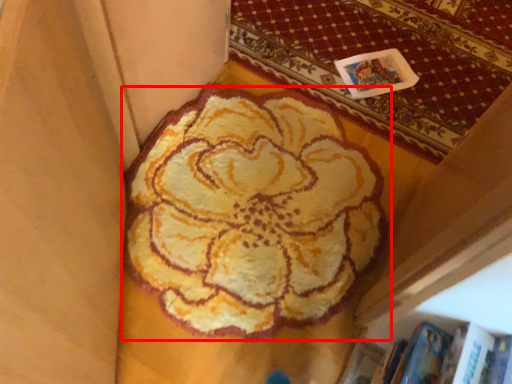
Question: Considering the relative positions of flower (annotated by the red box) and mat in the image provided, where is flower (annotated by the red box) located with respect to the staircase?

Choices:
 (A) left
 (B) right

Answer: (A)